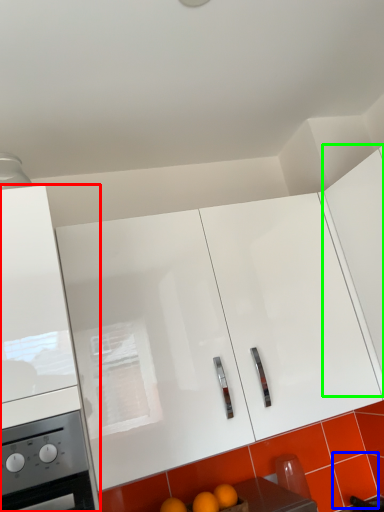
Question: Which is nearer to the cabinetry (highlighted by a red box)? tile (highlighted by a blue box) or cabinetry (highlighted by a green box).

Choices:
 (A) tile
 (B) cabinetry

Answer: (B)